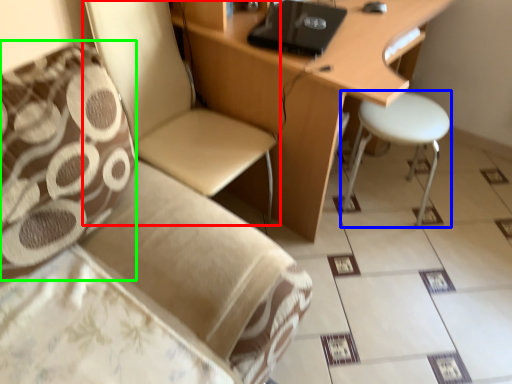
Question: Considering the real-world distances, which object is closest to chair (highlighted by a red box)? stool (highlighted by a blue box) or pillow (highlighted by a green box).

Choices:
 (A) stool
 (B) pillow

Answer: (B)